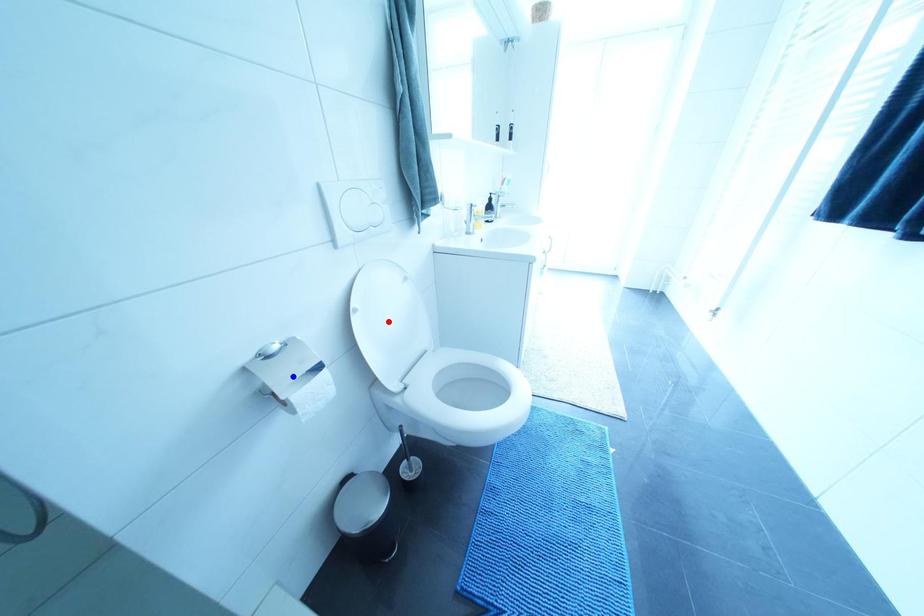
Question: Two points are marked on the image. Which point is closer to the camera?

Choices:
 (A) Blue point is closer.
 (B) Red point is closer.

Answer: (A)